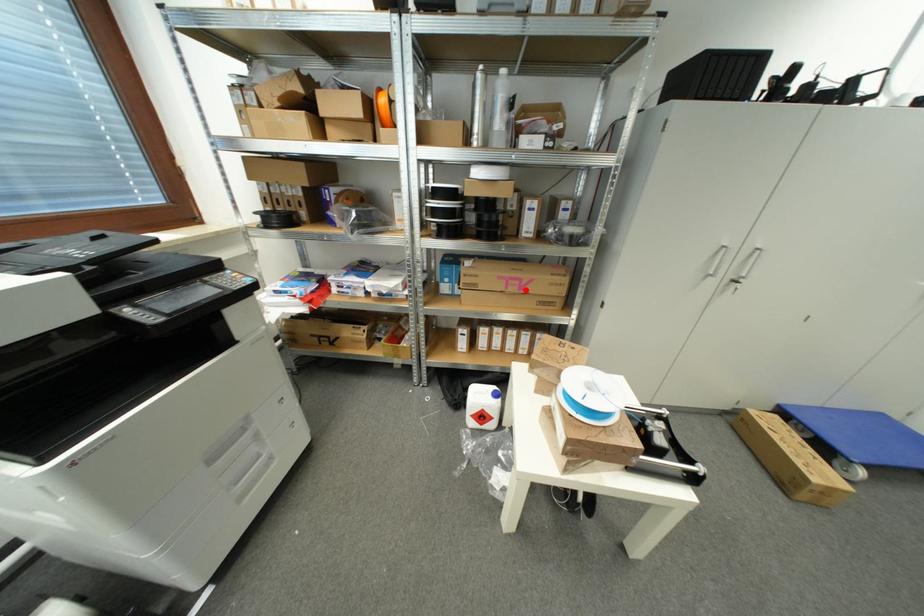
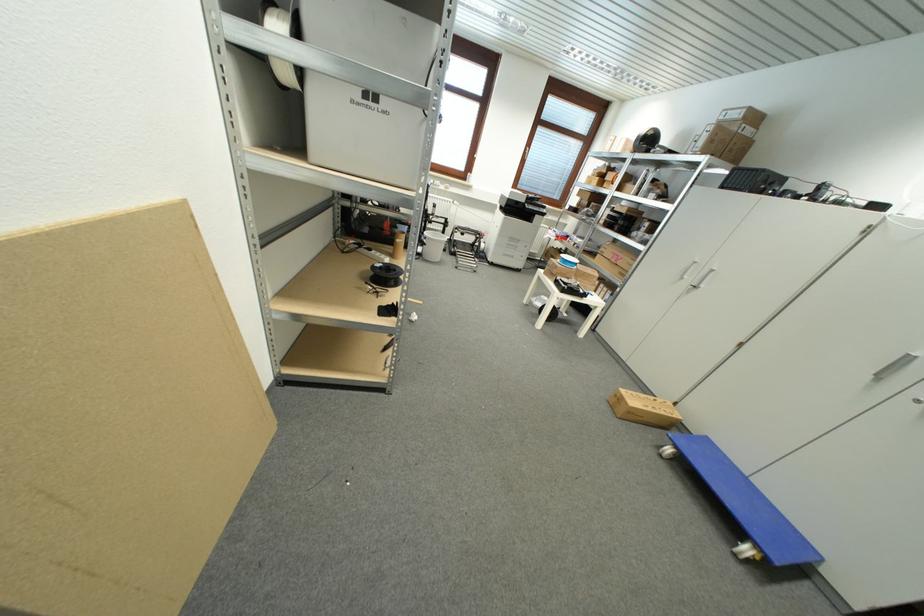
The point at the highlighted location is marked in the first image. Where is the corresponding point in the second image?

(621, 262)